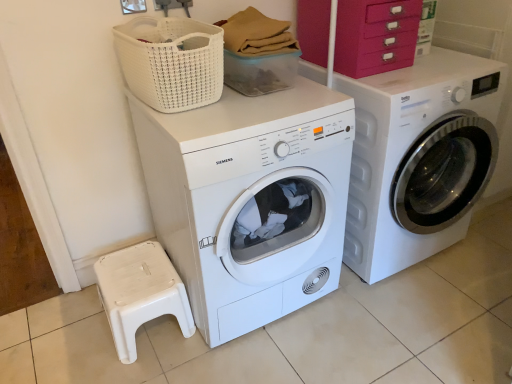
I want to click on free spot below white plastic step stool at lower left (from a real-world perspective), so click(x=155, y=332).